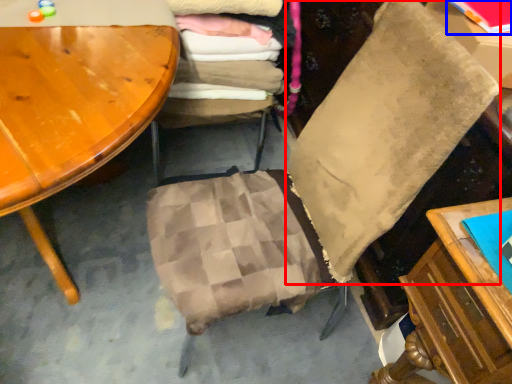
Question: Among these objects, which one is farthest to the camera, pillow (highlighted by a red box) or book (highlighted by a blue box)?

Choices:
 (A) pillow
 (B) book

Answer: (B)